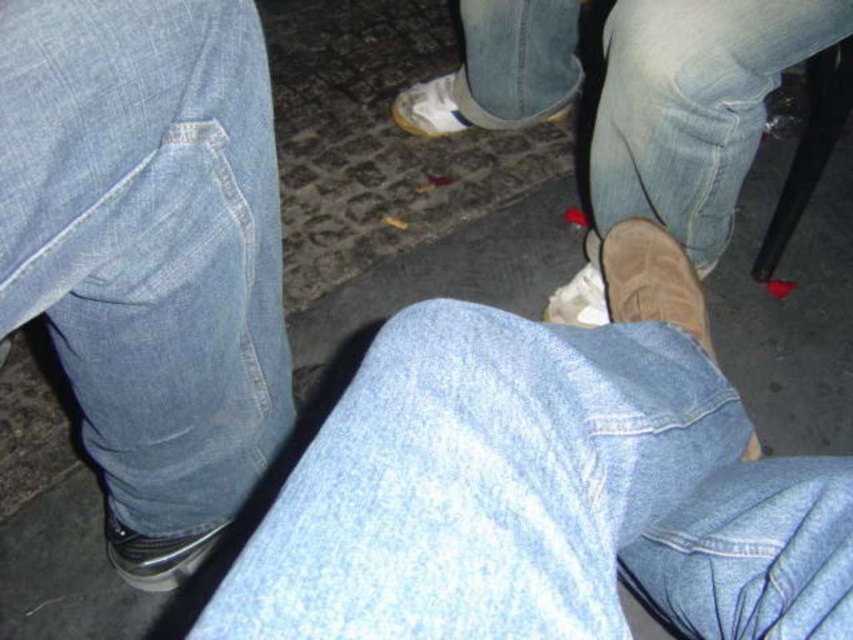
Where is `light blue denim jeans at center`? The width and height of the screenshot is (853, 640). light blue denim jeans at center is located at coordinates (538, 497).

Is light blue denim jeans at center shorter than suede brown boot at lower right?

No.

Identify the location of light blue denim jeans at center. (538, 497).

Who is higher up, denim at lower left or metallic silver shoe at lower left?

denim at lower left is higher up.

How distant is denim at lower left from metallic silver shoe at lower left?

denim at lower left and metallic silver shoe at lower left are 12.08 inches apart from each other.

Which is behind, point (51, 77) or point (120, 568)?

The point (120, 568) is behind.

I want to click on denim at lower left, so click(x=149, y=240).

Who is lower down, suede brown boot at lower right or white suede shoe at lower center?

suede brown boot at lower right is lower down.

Is point (604, 272) positioned before point (573, 285)?

Yes, it is.

In order to click on suede brown boot at lower right in this screenshot , I will do coord(653,280).